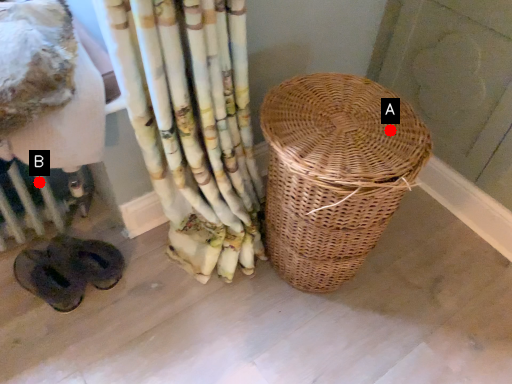
Question: Two points are circled on the image, labeled by A and B beside each circle. Which of the following is the closest to the observer?

Choices:
 (A) A is closer
 (B) B is closer

Answer: (A)